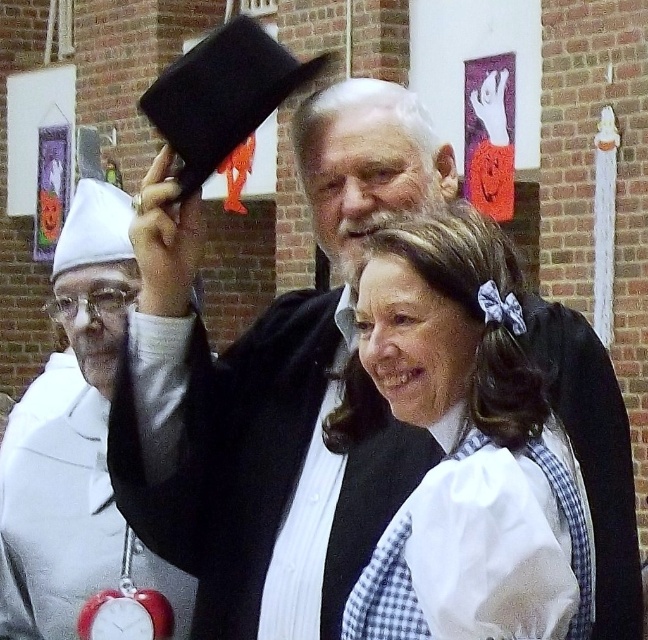
You are at a Halloween party and need to find the white cloth hat at left. Where should you look relative to the white gingham dress at center?

The white cloth hat at left is to the left of the white gingham dress at center.

You are standing in front of a brick wall with decorations. You see a matte black hat at upper center and a white cloth hat at left. Which hat is positioned to the right of the other?

The matte black hat at upper center is positioned to the right of the white cloth hat at left.

You are a photographer setting up for a group photo. You need to position the matte black hat at upper center and the white cloth hat at left so that both are clearly visible. Considering their heights, which hat should be placed higher in the frame to ensure both are visible without obstruction?

The matte black hat at upper center should be placed higher in the frame since it has a lesser height compared to the white cloth hat at left, allowing both to be visible without obstruction.